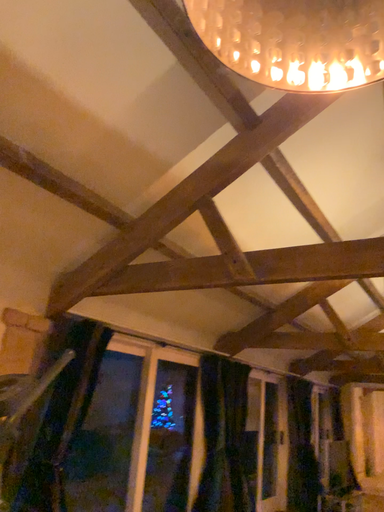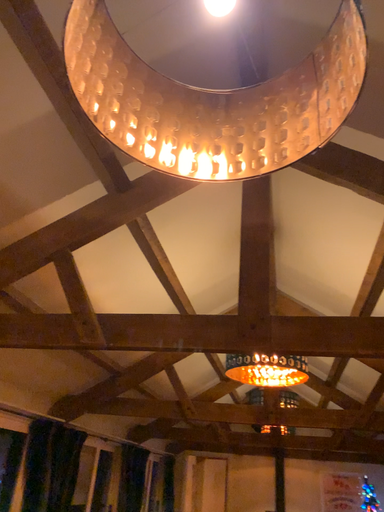
Question: How did the camera likely rotate when shooting the video?

Choices:
 (A) rotated upward
 (B) rotated downward

Answer: (A)